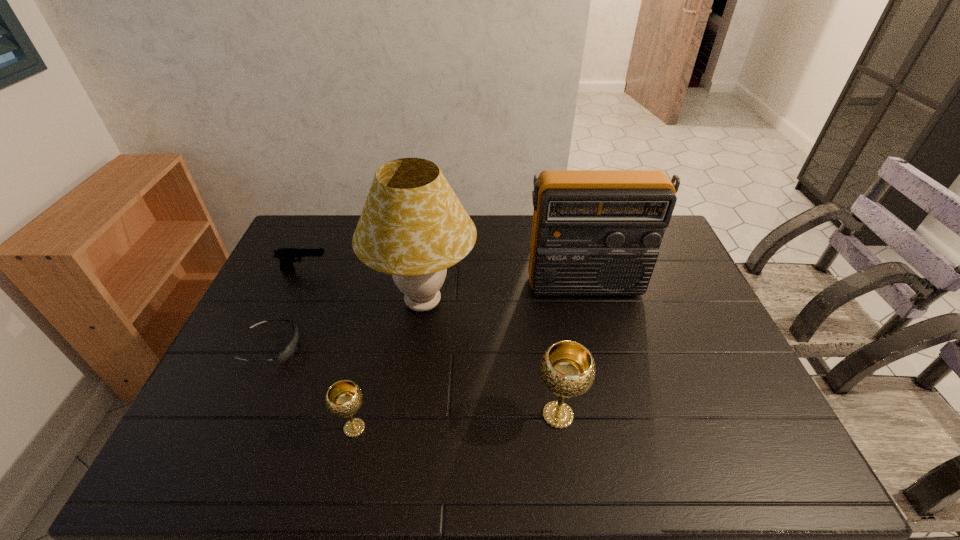
The width and height of the screenshot is (960, 540). Identify the location of vacant point located on the front-facing side of the fifth tallest object. (436, 270).

I want to click on free location located on the front-facing side of the radio receiver, so click(x=592, y=317).

In order to click on vacant area located 0.310m on the lenses of the goggles in this screenshot , I will do `click(411, 347)`.

Locate an element on the screen. free space located 0.080m on the front of the lampshade is located at coordinates (415, 368).

What are the coordinates of `pistol positioned at the left edge` in the screenshot? It's located at (x=287, y=256).

At what (x,y) coordinates should I click in order to perform the action: click on goggles present at the left edge. Please return your answer as a coordinate pair (x, y). Looking at the image, I should click on (288, 351).

At what (x,y) coordinates should I click in order to perform the action: click on free region at the far edge. Please return your answer as a coordinate pair (x, y). The height and width of the screenshot is (540, 960). Looking at the image, I should click on (336, 245).

The height and width of the screenshot is (540, 960). I want to click on vacant space at the near edge of the desktop, so click(x=324, y=403).

The image size is (960, 540). Identify the location of vacant area at the left edge. (299, 284).

In the image, there is a desktop. At what (x,y) coordinates should I click in order to perform the action: click on vacant space at the right edge. Please return your answer as a coordinate pair (x, y). Looking at the image, I should click on (724, 383).